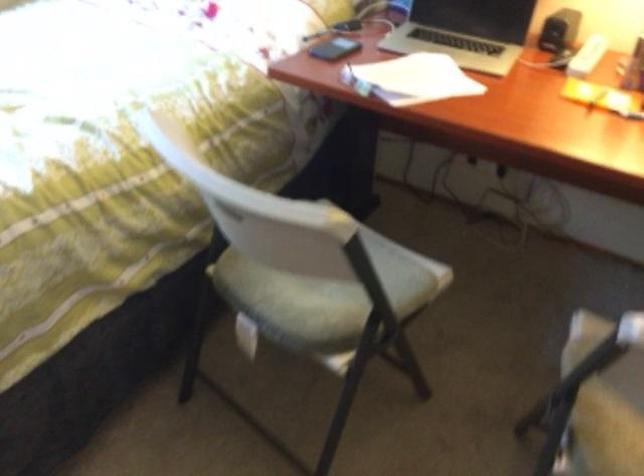
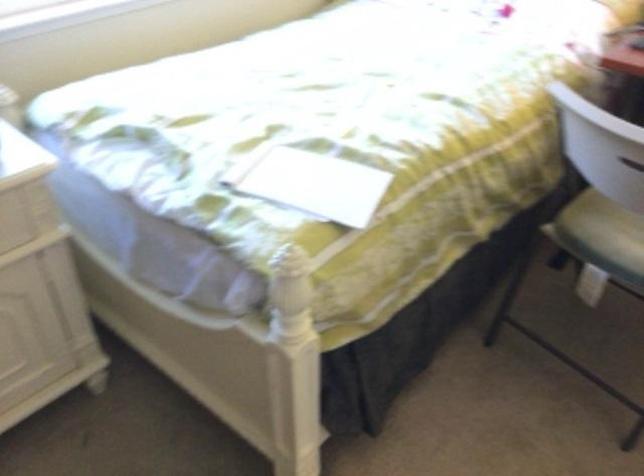
Question: How did the camera likely rotate?

Choices:
 (A) Left
 (B) Right
 (C) Up
 (D) Down

Answer: (A)